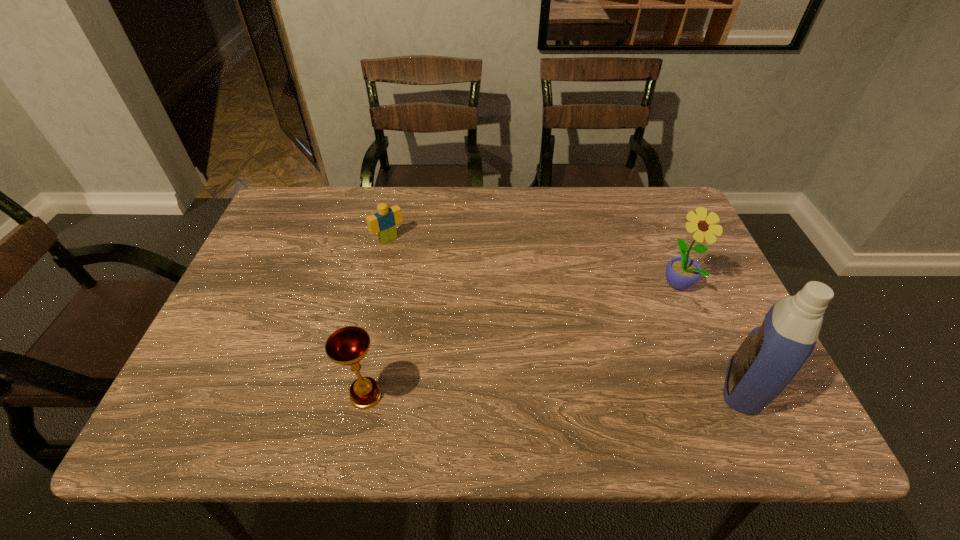
You are a GUI agent. You are given a task and a screenshot of the screen. Output one action in this format:
    pyautogui.click(x=<x>, y=<y>)
    Task: Click on the vacant area at the far edge
    The height and width of the screenshot is (540, 960).
    Given the screenshot: What is the action you would take?
    pyautogui.click(x=574, y=216)

The image size is (960, 540). What are the coordinates of `free space at the near edge of the desktop` in the screenshot? It's located at (596, 374).

Identify the location of vacant space at the left edge. (229, 308).

In the image, there is a desktop. Where is `vacant region at the right edge`? This screenshot has height=540, width=960. vacant region at the right edge is located at coordinates (704, 305).

Find the location of a particular element. The image size is (960, 540). vacant area at the far left corner of the desktop is located at coordinates click(327, 187).

Locate an element on the screen. vacant position at the near left corner of the desktop is located at coordinates (259, 377).

Locate an element on the screen. This screenshot has height=540, width=960. vacant region at the far right corner of the desktop is located at coordinates (679, 211).

Identify the location of free point between the second shortest object and the farthest object. Image resolution: width=960 pixels, height=540 pixels. (377, 318).

Identify the location of empty space between the shortest object and the tallest object. The image size is (960, 540). (566, 313).

Locate an element on the screen. The width and height of the screenshot is (960, 540). free space between the detergent and the third nearest object is located at coordinates (710, 335).